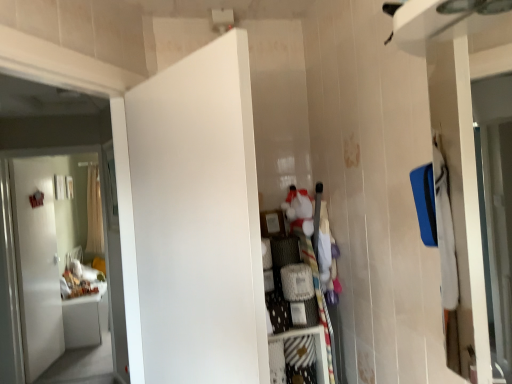
Find the location of a particular element. The width and height of the screenshot is (512, 384). white sheer curtain at left is located at coordinates (94, 213).

Describe the element at coordinates (194, 223) in the screenshot. I see `white matte door at center, acting as the 1th door starting from the front` at that location.

Find the location of a particular element. white sheer curtain at left is located at coordinates (94, 213).

Which object is thinner, white sheer curtain at left or white matte door at center, which is counted as the second door, starting from the left?

Thinner between the two is white matte door at center, which is counted as the second door, starting from the left.

Does white sheer curtain at left have a greater height compared to white matte door at center, acting as the 1th door starting from the front?

Yes, white sheer curtain at left is taller than white matte door at center, acting as the 1th door starting from the front.

Looking at the image, does white sheer curtain at left seem bigger or smaller compared to white matte door at center, acting as the 1th door starting from the front?

white sheer curtain at left is smaller than white matte door at center, acting as the 1th door starting from the front.

Is point (146, 364) positioned behind point (21, 329)?

That is False.

How different are the orientations of white matte door at center, which is counted as the second door, starting from the left, and white matte door at left, marked as the 1th door in a left-to-right arrangement, in degrees?

66.1 degrees.

Based on the photo, does white matte door at center, positioned as the first door in right-to-left order, have a lesser height compared to white matte door at left, which is the second door from right to left?

Correct, white matte door at center, positioned as the first door in right-to-left order, is not as tall as white matte door at left, which is the second door from right to left.

Where is `door above the white matte door at left, marked as the 2th door in a front-to-back arrangement (from a real-world perspective)`? This screenshot has width=512, height=384. door above the white matte door at left, marked as the 2th door in a front-to-back arrangement (from a real-world perspective) is located at coordinates (194, 223).

Which point is more distant from viewer, (35, 244) or (97, 205)?

The point (97, 205) is farther.

Which door is the 1st one when counting from the front of the white sheer curtain at left? Please provide its 2D coordinates.

[(51, 263)]

Is white matte door at left, placed as the 1th door when sorted from back to front, facing towards white sheer curtain at left?

No, white matte door at left, placed as the 1th door when sorted from back to front, is not turned towards white sheer curtain at left.

Looking at the image, does white sheer curtain at left seem bigger or smaller compared to white matte door at left, marked as the 2th door in a front-to-back arrangement?

In the image, white sheer curtain at left appears to be smaller than white matte door at left, marked as the 2th door in a front-to-back arrangement.

Is point (96, 195) farther from viewer compared to point (36, 295)?

That is True.

Is white sheer curtain at left not close to white matte door at left, marked as the 1th door in a left-to-right arrangement?

white sheer curtain at left is near white matte door at left, marked as the 1th door in a left-to-right arrangement, not far away.

Can you confirm if white sheer curtain at left is thinner than white matte door at left, marked as the 1th door in a left-to-right arrangement?

No.

Considering the points (234, 252) and (298, 244), which point is behind, point (234, 252) or point (298, 244)?

The point (298, 244) is behind.

This screenshot has height=384, width=512. Find the location of `door that appears in front of the white fabric dresser at center`. door that appears in front of the white fabric dresser at center is located at coordinates (194, 223).

From a real-world perspective, is white matte door at center, the second door viewed from the back, on top of white fabric dresser at center?

Correct, in the physical world, white matte door at center, the second door viewed from the back, is higher than white fabric dresser at center.

In order to click on curtain on the left side of white matte door at center, the second door viewed from the back in this screenshot , I will do `click(94, 213)`.

In the scene shown: Considering the relative positions of white matte door at center, acting as the 1th door starting from the front, and white sheer curtain at left in the image provided, is white matte door at center, acting as the 1th door starting from the front, to the right of white sheer curtain at left from the viewer's perspective?

Yes.

Would you say white matte door at center, which is counted as the second door, starting from the left, is inside or outside white sheer curtain at left?

white matte door at center, which is counted as the second door, starting from the left, is not enclosed by white sheer curtain at left.

Considering the points (138, 354) and (92, 186), which point is behind, point (138, 354) or point (92, 186)?

Positioned behind is point (92, 186).

Which object is further away from the camera, white fabric dresser at center or white matte door at left, placed as the 1th door when sorted from back to front?

white matte door at left, placed as the 1th door when sorted from back to front.

How different are the orientations of white fabric dresser at center and white matte door at left, marked as the 2th door in a front-to-back arrangement, in degrees?

The angular difference between white fabric dresser at center and white matte door at left, marked as the 2th door in a front-to-back arrangement, is 5.6 degrees.

From the picture: Is white matte door at left, marked as the 2th door in a front-to-back arrangement, a part of white fabric dresser at center?

No, white matte door at left, marked as the 2th door in a front-to-back arrangement, is not a part of white fabric dresser at center.

From a real-world perspective, is white fabric dresser at center beneath white matte door at left, marked as the 1th door in a left-to-right arrangement?

No, from a real-world perspective, white fabric dresser at center is not below white matte door at left, marked as the 1th door in a left-to-right arrangement.

Where is `the 2nd door to the right of the white sheer curtain at left, counting from the anchor's position`? Image resolution: width=512 pixels, height=384 pixels. the 2nd door to the right of the white sheer curtain at left, counting from the anchor's position is located at coordinates (194, 223).

Where is `door located behind the white matte door at center, the second door viewed from the back`? The height and width of the screenshot is (384, 512). door located behind the white matte door at center, the second door viewed from the back is located at coordinates (51, 263).

From the image, which object appears to be nearer to white fabric dresser at center, white sheer curtain at left or white matte door at center, the second door viewed from the back?

Based on the image, white matte door at center, the second door viewed from the back, appears to be nearer to white fabric dresser at center.

Based on their spatial positions, is white matte door at center, the second door viewed from the back, or white fabric dresser at center closer to white matte door at left, placed as the 1th door when sorted from back to front?

white matte door at center, the second door viewed from the back, lies closer to white matte door at left, placed as the 1th door when sorted from back to front, than the other object.

Which object lies further to the anchor point white fabric dresser at center, white sheer curtain at left or white matte door at left, marked as the 2th door in a front-to-back arrangement?

white matte door at left, marked as the 2th door in a front-to-back arrangement, is further to white fabric dresser at center.

Estimate the real-world distances between objects in this image. Which object is further from white fabric dresser at center, white matte door at left, placed as the 1th door when sorted from back to front, or white sheer curtain at left?

white matte door at left, placed as the 1th door when sorted from back to front, is further to white fabric dresser at center.

Estimate the real-world distances between objects in this image. Which object is closer to white sheer curtain at left, white matte door at center, positioned as the first door in right-to-left order, or white fabric dresser at center?

white matte door at center, positioned as the first door in right-to-left order.

Estimate the real-world distances between objects in this image. Which object is further from white matte door at left, marked as the 2th door in a front-to-back arrangement, white sheer curtain at left or white fabric dresser at center?

Among the two, white fabric dresser at center is located further to white matte door at left, marked as the 2th door in a front-to-back arrangement.

Based on their spatial positions, is white sheer curtain at left or white matte door at left, placed as the 1th door when sorted from back to front, closer to white matte door at center, the second door viewed from the back?

Based on the image, white matte door at left, placed as the 1th door when sorted from back to front, appears to be nearer to white matte door at center, the second door viewed from the back.

Which object lies nearer to the anchor point white matte door at left, which is the second door from right to left, white fabric dresser at center or white sheer curtain at left?

white sheer curtain at left is closer to white matte door at left, which is the second door from right to left.

At what (x,y) coordinates should I click in order to perform the action: click on door positioned between white fabric dresser at center and white sheer curtain at left from near to far. Please return your answer as a coordinate pair (x, y). Looking at the image, I should click on (51, 263).

Locate an element on the screen. The width and height of the screenshot is (512, 384). dresser between white matte door at center, acting as the 1th door starting from the front, and white sheer curtain at left in the front-back direction is located at coordinates (311, 255).

What are the coordinates of `dresser between white matte door at center, positioned as the first door in right-to-left order, and white matte door at left, marked as the 1th door in a left-to-right arrangement, along the z-axis` in the screenshot? It's located at (311, 255).

This screenshot has width=512, height=384. What are the coordinates of `door located between white matte door at center, which is counted as the second door, starting from the left, and white sheer curtain at left in the depth direction` in the screenshot? It's located at (51, 263).